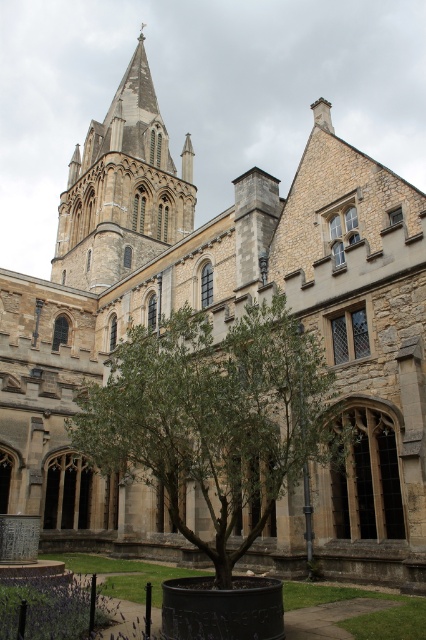
Can you confirm if green leafy tree at center is positioned to the right of smooth stone tower at upper left?

Correct, you'll find green leafy tree at center to the right of smooth stone tower at upper left.

Which is more to the right, green leafy tree at center or smooth stone tower at upper left?

green leafy tree at center

Describe the element at coordinates (213, 417) in the screenshot. This screenshot has width=426, height=640. I see `green leafy tree at center` at that location.

Locate an element on the screen. The width and height of the screenshot is (426, 640). green leafy tree at center is located at coordinates (213, 417).